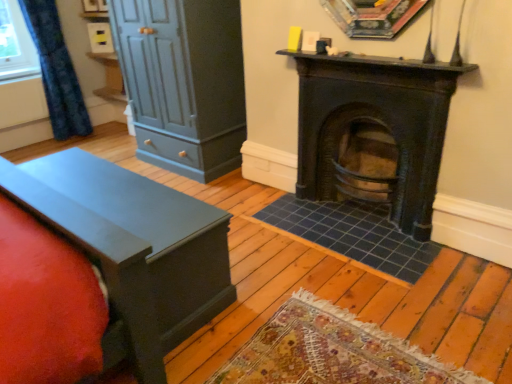
In order to face dark brown wood burning stove at center, should I rotate leftwards or rightwards?

A 15.062 degree turn to the right will do.

Measure the distance between point (165, 350) and camera.

Point (165, 350) and camera are 5.68 feet apart from each other.

In order to face matte dark gray dresser at left, should I rotate leftwards or rightwards?

You should look left and rotate roughly 9.555 degrees.

This screenshot has height=384, width=512. In order to click on dark brown wood burning stove at center in this screenshot , I will do [374, 126].

In the scene shown: From the image's perspective, is blue textured curtain at left on top of matte dark gray dresser at left?

Yes, from the image's perspective, blue textured curtain at left is on top of matte dark gray dresser at left.

At what (x,y) coordinates should I click in order to perform the action: click on dresser that appears on the right of blue textured curtain at left. Please return your answer as a coordinate pair (x, y). The width and height of the screenshot is (512, 384). Looking at the image, I should click on (183, 82).

Would you say blue textured curtain at left is inside or outside matte dark gray dresser at left?

blue textured curtain at left exists outside the volume of matte dark gray dresser at left.

Are blue textured curtain at left and matte dark gray dresser at left far apart?

Yes, blue textured curtain at left and matte dark gray dresser at left are quite far apart.

Looking at this image, considering the sizes of objects matte black chest at left and matte dark gray dresser at left in the image provided, who is wider, matte black chest at left or matte dark gray dresser at left?

matte dark gray dresser at left.

Is matte black chest at left in front of matte dark gray dresser at left?

Yes, matte black chest at left is closer to the camera.

Is matte black chest at left bigger or smaller than matte dark gray dresser at left?

Considering their sizes, matte black chest at left takes up less space than matte dark gray dresser at left.

From the image's perspective, which is below, matte black chest at left or matte dark gray dresser at left?

matte black chest at left is shown below in the image.

From their relative heights in the image, would you say dark brown wood burning stove at center is taller or shorter than matte dark gray dresser at left?

Considering their sizes, dark brown wood burning stove at center has less height than matte dark gray dresser at left.

Find the location of a particular element. This screenshot has width=512, height=384. wood burning stove on the right of the matte dark gray dresser at left is located at coordinates (374, 126).

Between point (407, 61) and point (138, 66), which one is positioned in front?

The point (407, 61) is more forward.

Is dark brown wood burning stove at center at the right side of matte dark gray dresser at left?

Yes, dark brown wood burning stove at center is to the right of matte dark gray dresser at left.

Can you see blue textured curtain at left touching matte black chest at left?

blue textured curtain at left and matte black chest at left are not in contact.

From a real-world perspective, is blue textured curtain at left positioned above or below matte black chest at left?

From a real-world perspective, blue textured curtain at left is physically above matte black chest at left.

Based on the photo, does blue textured curtain at left appear on the right side of matte black chest at left?

In fact, blue textured curtain at left is to the left of matte black chest at left.

Would you say blue textured curtain at left is inside or outside matte black chest at left?

blue textured curtain at left is not inside matte black chest at left, it's outside.

From the image's perspective, relative to matte black chest at left, is dark brown wood burning stove at center above or below?

From the image's perspective, dark brown wood burning stove at center appears above matte black chest at left.

From the picture: Is matte black chest at left inside dark brown wood burning stove at center?

No.

Who is bigger, dark brown wood burning stove at center or matte black chest at left?

matte black chest at left is bigger.

Which of these two, dark brown wood burning stove at center or matte black chest at left, is wider?

With larger width is matte black chest at left.

Considering the relative positions of matte black chest at left and blue textured curtain at left in the image provided, is matte black chest at left to the right of blue textured curtain at left from the viewer's perspective?

Yes, matte black chest at left is to the right of blue textured curtain at left.

Relative to blue textured curtain at left, is matte black chest at left in front or behind?

matte black chest at left is positioned closer to the viewer than blue textured curtain at left.

In the scene shown: Which of these two, matte black chest at left or blue textured curtain at left, is wider?

With larger width is matte black chest at left.

Is dark brown wood burning stove at center with blue textured curtain at left?

No, dark brown wood burning stove at center is not in contact with blue textured curtain at left.

Is the position of dark brown wood burning stove at center more distant than that of blue textured curtain at left?

No, dark brown wood burning stove at center is in front of blue textured curtain at left.

Image resolution: width=512 pixels, height=384 pixels. Find the location of `wood burning stove that appears on the right of blue textured curtain at left`. wood burning stove that appears on the right of blue textured curtain at left is located at coordinates (374, 126).

Is blue textured curtain at left surrounded by dark brown wood burning stove at center?

No, dark brown wood burning stove at center does not contain blue textured curtain at left.

What are the coordinates of `curtain lying behind the matte dark gray dresser at left` in the screenshot? It's located at (56, 70).

Where is `dresser above the matte black chest at left (from a real-world perspective)`? The height and width of the screenshot is (384, 512). dresser above the matte black chest at left (from a real-world perspective) is located at coordinates (183, 82).

Looking at the image, which one is located closer to matte black chest at left, blue textured curtain at left or matte dark gray dresser at left?

The object closer to matte black chest at left is matte dark gray dresser at left.

Looking at the image, which one is located further to matte dark gray dresser at left, blue textured curtain at left or dark brown wood burning stove at center?

blue textured curtain at left.

Looking at the image, which one is located further to blue textured curtain at left, matte black chest at left or matte dark gray dresser at left?

Based on the image, matte black chest at left appears to be further to blue textured curtain at left.

Based on their spatial positions, is dark brown wood burning stove at center or blue textured curtain at left further from matte black chest at left?

blue textured curtain at left.

Looking at the image, which one is located closer to dark brown wood burning stove at center, blue textured curtain at left or matte black chest at left?

matte black chest at left is positioned closer to the anchor dark brown wood burning stove at center.

Estimate the real-world distances between objects in this image. Which object is closer to dark brown wood burning stove at center, blue textured curtain at left or matte dark gray dresser at left?

Based on the image, matte dark gray dresser at left appears to be nearer to dark brown wood burning stove at center.

From the image, which object appears to be farther from blue textured curtain at left, matte black chest at left or dark brown wood burning stove at center?

dark brown wood burning stove at center.

When comparing their distances from blue textured curtain at left, does dark brown wood burning stove at center or matte dark gray dresser at left seem further?

Based on the image, dark brown wood burning stove at center appears to be further to blue textured curtain at left.

The height and width of the screenshot is (384, 512). I want to click on dresser located between matte black chest at left and blue textured curtain at left in the depth direction, so click(183, 82).

Where is `dresser located between matte black chest at left and dark brown wood burning stove at center in the left-right direction`? This screenshot has height=384, width=512. dresser located between matte black chest at left and dark brown wood burning stove at center in the left-right direction is located at coordinates (183, 82).

Identify the location of furniture between blue textured curtain at left and dark brown wood burning stove at center in the horizontal direction. (134, 248).

Identify the location of dresser between blue textured curtain at left and dark brown wood burning stove at center from left to right. (183, 82).